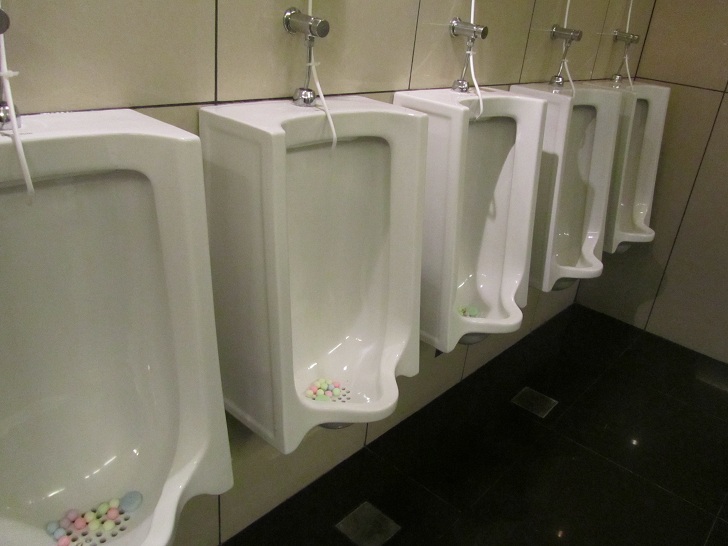
Find the location of a particular element. This screenshot has height=546, width=728. mens toilet is located at coordinates (71, 135), (282, 136), (443, 106), (561, 94), (637, 100).